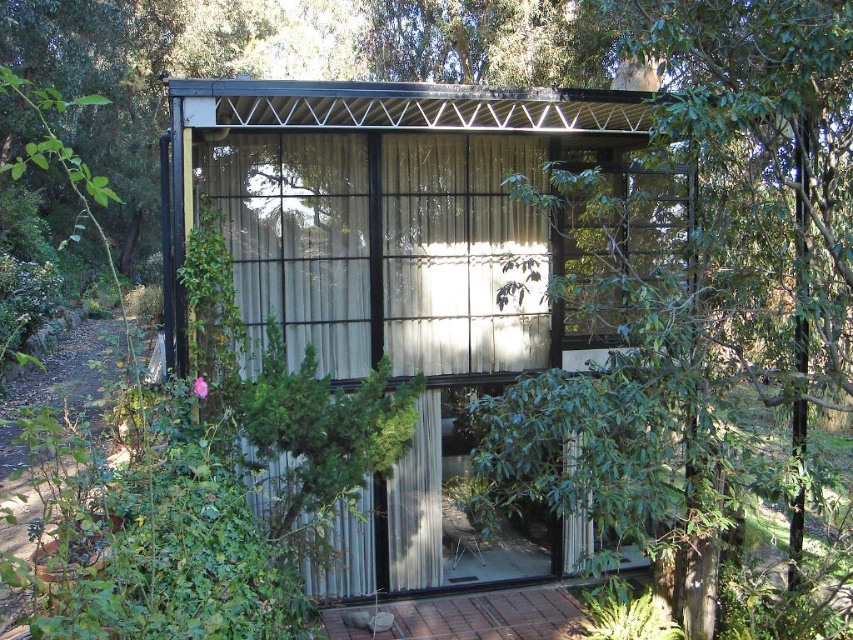
Question: Which point is farther to the camera?

Choices:
 (A) metallic corrugated hut at center
 (B) green leafy tree at center

Answer: (A)

Question: Is green leafy tree at center to the right of metallic corrugated hut at center from the viewer's perspective?

Choices:
 (A) yes
 (B) no

Answer: (A)

Question: Can you confirm if green leafy tree at center is positioned to the left of metallic corrugated hut at center?

Choices:
 (A) yes
 (B) no

Answer: (B)

Question: From the image, what is the correct spatial relationship of green leafy tree at center in relation to metallic corrugated hut at center?

Choices:
 (A) left
 (B) right

Answer: (B)

Question: Which point is farther from the camera taking this photo?

Choices:
 (A) (438, 212)
 (B) (573, 404)

Answer: (A)

Question: Among these points, which one is farthest from the camera?

Choices:
 (A) (653, 51)
 (B) (430, 96)

Answer: (B)